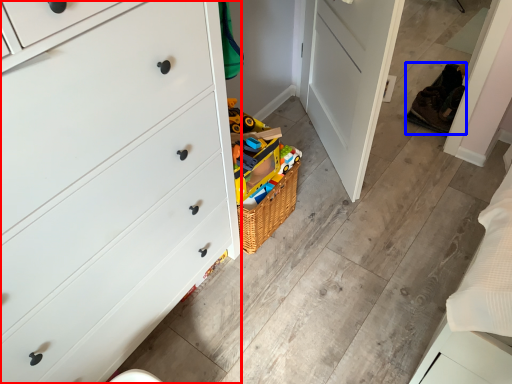
Question: Which object is further to the camera taking this photo, chest of drawers (highlighted by a red box) or shoe (highlighted by a blue box)?

Choices:
 (A) chest of drawers
 (B) shoe

Answer: (B)